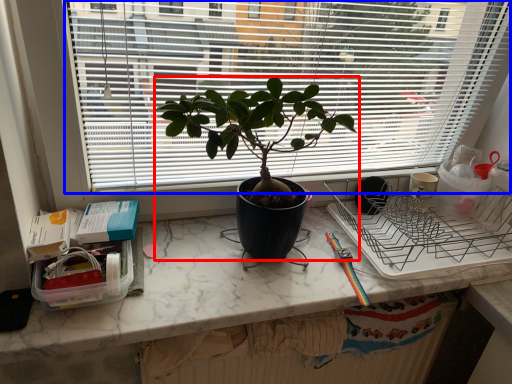
Question: Which object is closer to the camera taking this photo, houseplant (highlighted by a red box) or window (highlighted by a blue box)?

Choices:
 (A) houseplant
 (B) window

Answer: (B)